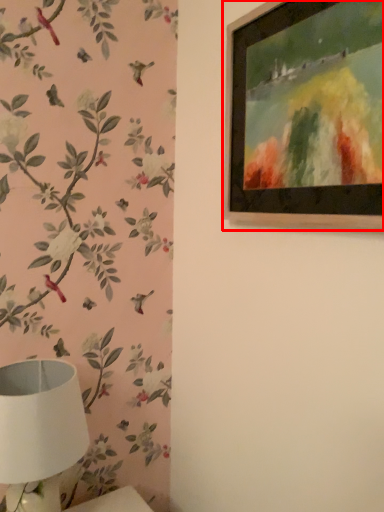
Question: Considering the relative positions of picture frame (annotated by the red box) and table lamp in the image provided, where is picture frame (annotated by the red box) located with respect to the staircase?

Choices:
 (A) right
 (B) left

Answer: (A)